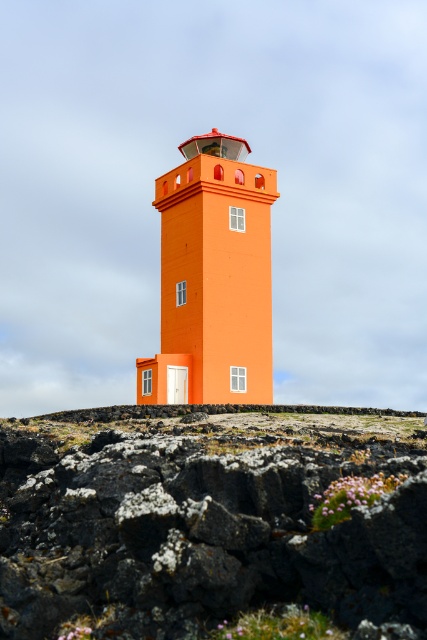
Question: Can you confirm if volcanic rock at center is positioned below orange matte/lightweight tower at center?

Choices:
 (A) no
 (B) yes

Answer: (B)

Question: Among these points, which one is farthest from the camera?

Choices:
 (A) (201, 170)
 (B) (28, 582)

Answer: (A)

Question: Among these objects, which one is farthest from the camera?

Choices:
 (A) volcanic rock at center
 (B) orange matte/lightweight tower at center

Answer: (B)

Question: Can you confirm if volcanic rock at center is positioned to the left of orange matte/lightweight tower at center?

Choices:
 (A) yes
 (B) no

Answer: (B)

Question: Can you confirm if volcanic rock at center is bigger than orange matte/lightweight tower at center?

Choices:
 (A) no
 (B) yes

Answer: (A)